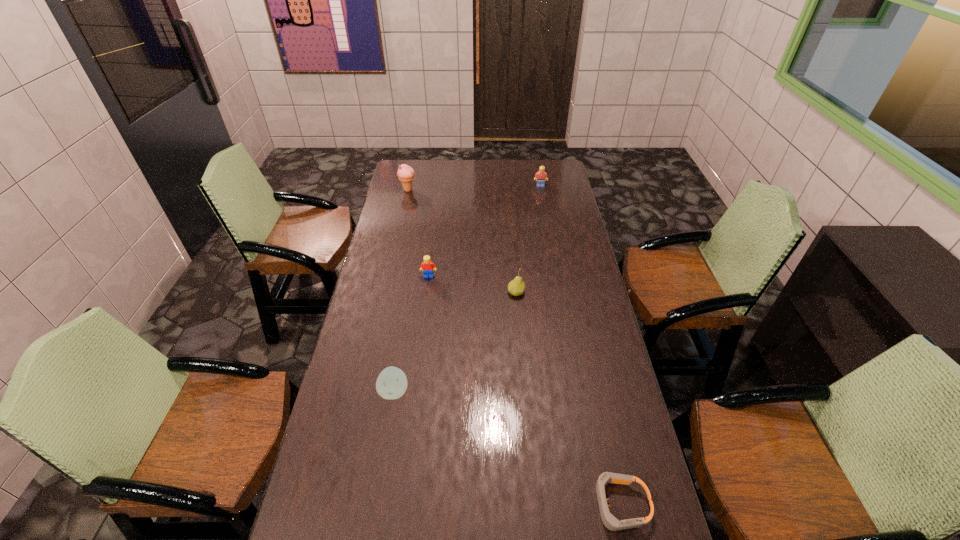
Identify the location of the tallest object. The image size is (960, 540). (405, 173).

Find the location of `icecream`. icecream is located at coordinates [x=405, y=173].

Where is `the right Lego`? the right Lego is located at coordinates (540, 176).

Identify the location of the third nearest object. (516, 287).

Locate an element on the screen. The image size is (960, 540). pear is located at coordinates (516, 287).

This screenshot has width=960, height=540. In order to click on the left Lego in this screenshot , I will do `click(427, 266)`.

This screenshot has width=960, height=540. Identify the location of the nearer Lego. (427, 266).

Where is `apple`? The width and height of the screenshot is (960, 540). apple is located at coordinates (391, 383).

This screenshot has height=540, width=960. Identify the location of goggles. (x=610, y=522).

Locate an element on the screen. the shortest object is located at coordinates (610, 522).